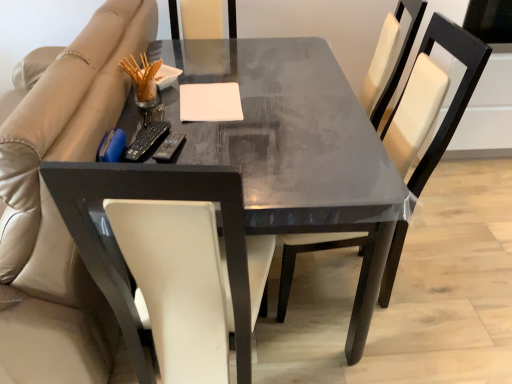
The height and width of the screenshot is (384, 512). Identify the location of free space to the left of white matte notepad at center. (156, 113).